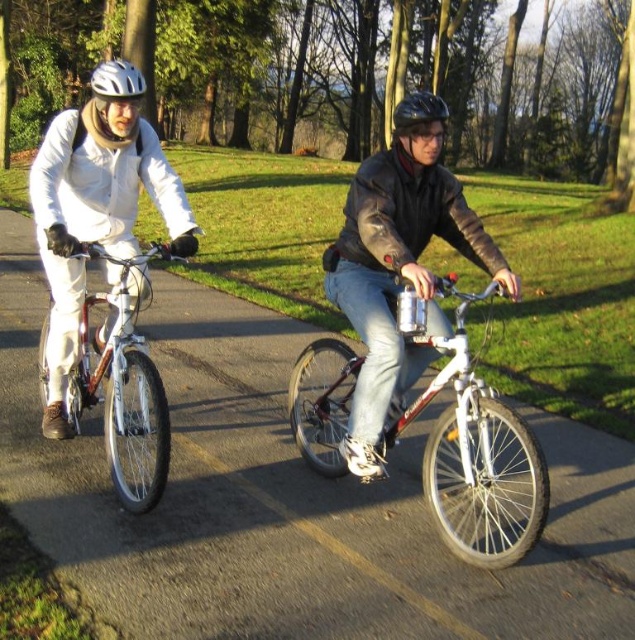
Is shiny metallic bicycle at left to the right of black matte helmet at upper center from the viewer's perspective?

No, shiny metallic bicycle at left is not to the right of black matte helmet at upper center.

Is point (161, 419) behind point (439, 134)?

No, it is in front of (439, 134).

At what (x,y) coordinates should I click in order to perform the action: click on shiny metallic bicycle at left. Please return your answer as a coordinate pair (x, y). This screenshot has width=635, height=640. Looking at the image, I should click on (123, 384).

Between matte black jacket at center and matte white jacket at left, which one is positioned higher?

Positioned higher is matte white jacket at left.

Who is more forward, (358, 179) or (90, 193)?

Positioned in front is point (358, 179).

Is point (335, 252) positioned before point (37, 212)?

No, (335, 252) is behind (37, 212).

Where is `matte black jacket at center`? Image resolution: width=635 pixels, height=640 pixels. matte black jacket at center is located at coordinates (398, 273).

Who is shorter, black matte helmet at upper center or black matte bicycle helmet at center?

Standing shorter between the two is black matte helmet at upper center.

Who is more forward, (438, 134) or (422, 116)?

Point (422, 116)

Which is in front, point (439, 104) or point (429, 112)?

Point (429, 112)

The image size is (635, 640). I want to click on black matte helmet at upper center, so click(420, 125).